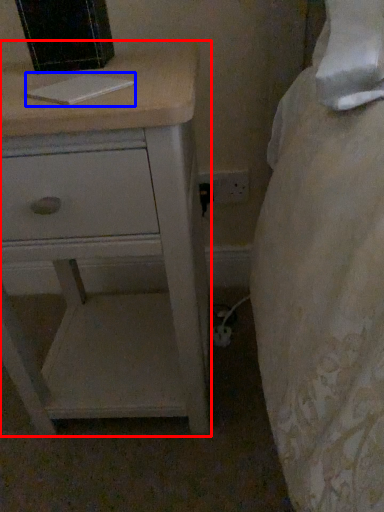
Question: Among these objects, which one is farthest to the camera, chest of drawers (highlighted by a red box) or book (highlighted by a blue box)?

Choices:
 (A) chest of drawers
 (B) book

Answer: (B)